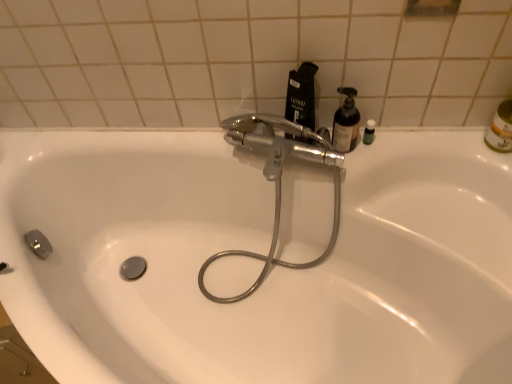
What do you see at coordinates (369, 132) in the screenshot? I see `green matte bottle at upper right` at bounding box center [369, 132].

Measure the distance between point (289, 88) and camera.

The depth of point (289, 88) is 39.13 inches.

Locate an element on the screen. This screenshot has height=384, width=512. black matte bottle at upper center is located at coordinates (301, 96).

Describe the element at coordinates (258, 252) in the screenshot. The image size is (512, 384). I see `white glossy sink at center` at that location.

Find the location of a particular element. This screenshot has height=384, width=512. chrome metallic faucet at center is located at coordinates (278, 181).

How different are the orientations of white glossy sink at center and black matte bottle at upper center in degrees?

The angle between the facing direction of white glossy sink at center and the facing direction of black matte bottle at upper center is 22.3 degrees.

Who is shorter, white glossy sink at center or black matte bottle at upper center?

Standing shorter between the two is black matte bottle at upper center.

In order to click on sink that is in front of the black matte bottle at upper center in this screenshot , I will do `click(258, 252)`.

Which is nearer, (387,205) or (308,139)?

The point (308,139) is closer to the camera.

Does chrome metallic faucet at center have a smaller size compared to white glossy sink at center?

Yes.

Is chrome metallic faucet at center to the left of white glossy sink at center from the viewer's perspective?

Correct, you'll find chrome metallic faucet at center to the left of white glossy sink at center.

Considering the points (307, 267) and (13, 284), which point is in front, point (307, 267) or point (13, 284)?

The point (13, 284) is in front.

Can you confirm if chrome metallic faucet at center is taller than white glossy sink at center?

No, chrome metallic faucet at center is not taller than white glossy sink at center.

Does translucent plastic bottle at upper right have a larger size compared to white glossy sink at center?

No, translucent plastic bottle at upper right is not bigger than white glossy sink at center.

Is translucent plastic bottle at upper right looking in the opposite direction of white glossy sink at center?

translucent plastic bottle at upper right does not have its back to white glossy sink at center.

What's the angular difference between translucent plastic bottle at upper right and white glossy sink at center's facing directions?

22.3 degrees.

Is point (348, 98) farther from camera compared to point (169, 253)?

That is False.

Can you confirm if green matte bottle at upper right is positioned to the left of chrome metallic faucet at center?

In fact, green matte bottle at upper right is to the right of chrome metallic faucet at center.

How far apart are green matte bottle at upper right and chrome metallic faucet at center?

12.13 inches.

Is green matte bottle at upper right taller or shorter than chrome metallic faucet at center?

green matte bottle at upper right is shorter than chrome metallic faucet at center.

Which of these two, green matte bottle at upper right or chrome metallic faucet at center, is thinner?

Thinner between the two is green matte bottle at upper right.

What's the angular difference between green matte bottle at upper right and translucent plastic bottle at upper right's facing directions?

The angular difference between green matte bottle at upper right and translucent plastic bottle at upper right is 0.00205 degrees.

From a real-world perspective, which is physically below, green matte bottle at upper right or translucent plastic bottle at upper right?

In real-world perspective, green matte bottle at upper right is lower.

In the image, is green matte bottle at upper right positioned in front of or behind translucent plastic bottle at upper right?

Clearly, green matte bottle at upper right is behind translucent plastic bottle at upper right.

Is green matte bottle at upper right far away from translucent plastic bottle at upper right?

No.

Considering the sizes of objects green matte bottle at upper right and black matte bottle at upper center in the image provided, who is thinner, green matte bottle at upper right or black matte bottle at upper center?

green matte bottle at upper right is thinner.

Can you confirm if green matte bottle at upper right is positioned to the right of black matte bottle at upper center?

Yes, green matte bottle at upper right is to the right of black matte bottle at upper center.

Is green matte bottle at upper right smaller than black matte bottle at upper center?

Yes.

Would you consider green matte bottle at upper right to be distant from black matte bottle at upper center?

Actually, green matte bottle at upper right and black matte bottle at upper center are a little close together.

Is point (113, 168) closer or farther from the camera than point (355, 112)?

Clearly, point (113, 168) is more distant from the camera than point (355, 112).

Is white glossy sink at center surrounding translucent plastic bottle at upper right?

No, white glossy sink at center does not contain translucent plastic bottle at upper right.

Does white glossy sink at center have a greater height compared to translucent plastic bottle at upper right?

Yes.

Where is `sink beneath the black matte bottle at upper center (from a real-world perspective)`? The width and height of the screenshot is (512, 384). sink beneath the black matte bottle at upper center (from a real-world perspective) is located at coordinates (258, 252).

Locate an element on the screen. The width and height of the screenshot is (512, 384). plumbing fixture above the white glossy sink at center (from a real-world perspective) is located at coordinates (278, 181).

When comparing their distances from black matte bottle at upper center, does translucent plastic bottle at upper right or green matte bottle at upper right seem further?

green matte bottle at upper right is further to black matte bottle at upper center.

From the image, which object appears to be nearer to black matte bottle at upper center, chrome metallic faucet at center or green matte bottle at upper right?

Among the two, chrome metallic faucet at center is located nearer to black matte bottle at upper center.

Which object lies nearer to the anchor point green matte bottle at upper right, white glossy sink at center or black matte bottle at upper center?

black matte bottle at upper center lies closer to green matte bottle at upper right than the other object.

Which object lies further to the anchor point translucent plastic bottle at upper right, chrome metallic faucet at center or green matte bottle at upper right?

The object further to translucent plastic bottle at upper right is chrome metallic faucet at center.

From the picture: From the image, which object appears to be farther from black matte bottle at upper center, green matte bottle at upper right or translucent plastic bottle at upper right?

The object further to black matte bottle at upper center is green matte bottle at upper right.

Estimate the real-world distances between objects in this image. Which object is further from translucent plastic bottle at upper right, green matte bottle at upper right or chrome metallic faucet at center?

chrome metallic faucet at center.

Looking at the image, which one is located closer to chrome metallic faucet at center, translucent plastic bottle at upper right or green matte bottle at upper right?

Based on the image, translucent plastic bottle at upper right appears to be nearer to chrome metallic faucet at center.

Which object lies further to the anchor point black matte bottle at upper center, translucent plastic bottle at upper right or chrome metallic faucet at center?

Based on the image, chrome metallic faucet at center appears to be further to black matte bottle at upper center.

You are a GUI agent. You are given a task and a screenshot of the screen. Output one action in this format:
    pyautogui.click(x=<x>, y=<y>)
    Task: Click on the mouthwash between black matte bottle at upper center and chrome metallic faucet at center in the vertical direction
    The width and height of the screenshot is (512, 384).
    Given the screenshot: What is the action you would take?
    pyautogui.click(x=346, y=122)

The height and width of the screenshot is (384, 512). In order to click on toiletry between black matte bottle at upper center and white glossy sink at center from top to bottom in this screenshot , I will do `click(369, 132)`.

Locate an element on the screen. This screenshot has height=384, width=512. toiletry that lies between translucent plastic bottle at upper right and white glossy sink at center from top to bottom is located at coordinates (369, 132).

Where is `plumbing fixture between translucent plastic bottle at upper right and white glossy sink at center vertically`? The height and width of the screenshot is (384, 512). plumbing fixture between translucent plastic bottle at upper right and white glossy sink at center vertically is located at coordinates (278, 181).